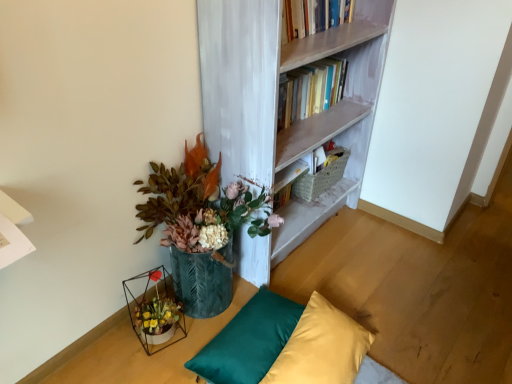
Find the location of a particular element. vacant area that lies between metallic green vase at lower left and white painted wood bookcase at upper center is located at coordinates (305, 263).